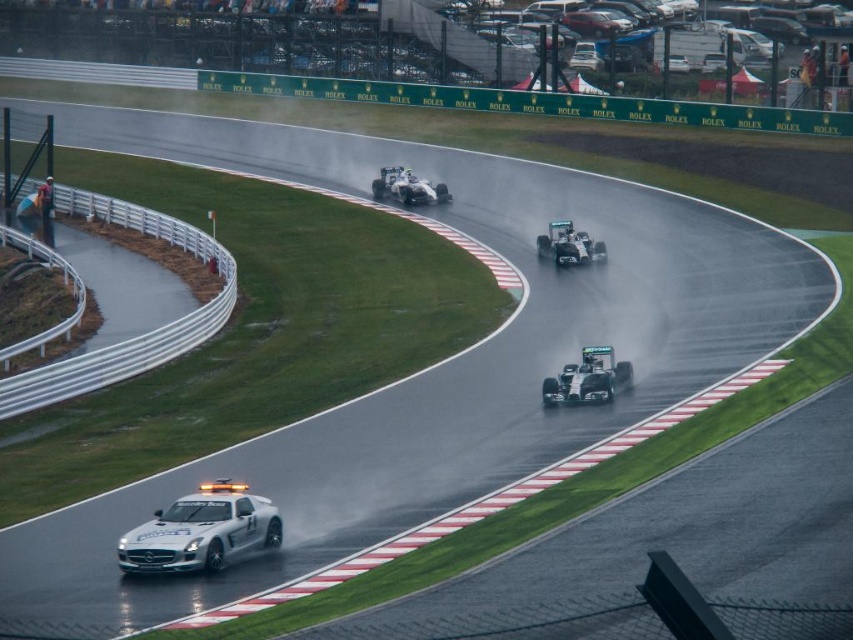
You are a race official observing the track. You notice the white glossy car at lower left and the metallic silver race car at upper center. Which of these two vehicles is smaller in size?

The white glossy car at lower left has a smaller size compared to the metallic silver race car at upper center, so the white glossy car at lower left is smaller.

You are a race car driver participating in a Formula One race on a wet track. You see the metallic silver race car at upper center and the white metallic race car at center. Which car is closer to you, the driver?

The white metallic race car at center is behind the metallic silver race car at upper center, so the metallic silver race car at upper center is closer to you.